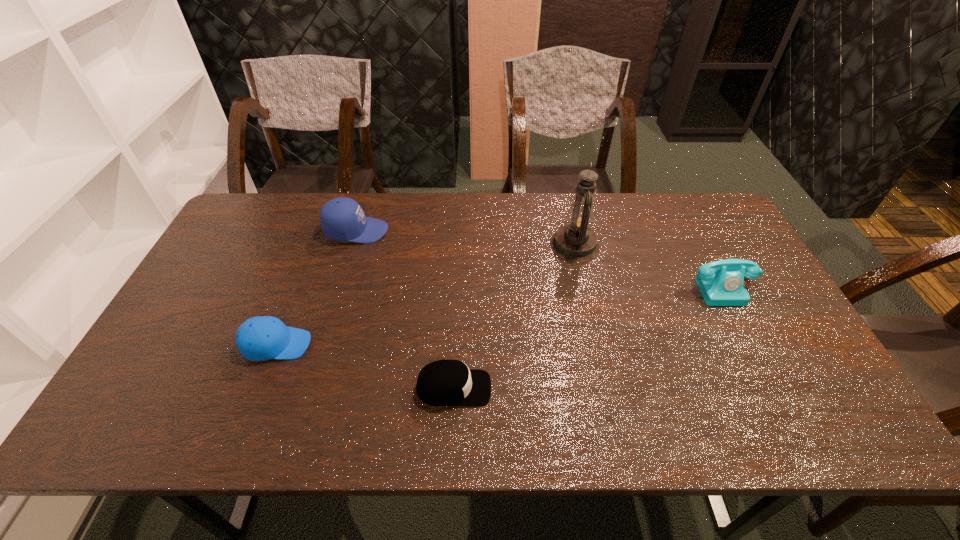
Locate an element on the screen. The image size is (960, 540). the fourth object from left to right is located at coordinates (575, 241).

Where is `oil lamp`? oil lamp is located at coordinates (575, 241).

Identify the location of the tallest cap. (342, 219).

The image size is (960, 540). What are the coordinates of `telephone` in the screenshot? It's located at (720, 283).

Locate an element on the screen. The image size is (960, 540). the rightmost object is located at coordinates (720, 283).

Identify the location of the fourth farthest object. Image resolution: width=960 pixels, height=540 pixels. (261, 338).

You are a GUI agent. You are given a task and a screenshot of the screen. Output one action in this format:
    pyautogui.click(x=<x>, y=<y>)
    Task: Click on the third object from left to right
    The image size is (960, 540).
    Given the screenshot: What is the action you would take?
    pyautogui.click(x=445, y=383)

Locate an element on the screen. the nearest cap is located at coordinates (445, 383).

The width and height of the screenshot is (960, 540). What are the coordinates of `free space located 0.180m on the front of the tallest object` in the screenshot? It's located at (588, 308).

Find the location of `vacant space situated on the front-facing side of the farthest cap`. vacant space situated on the front-facing side of the farthest cap is located at coordinates (416, 231).